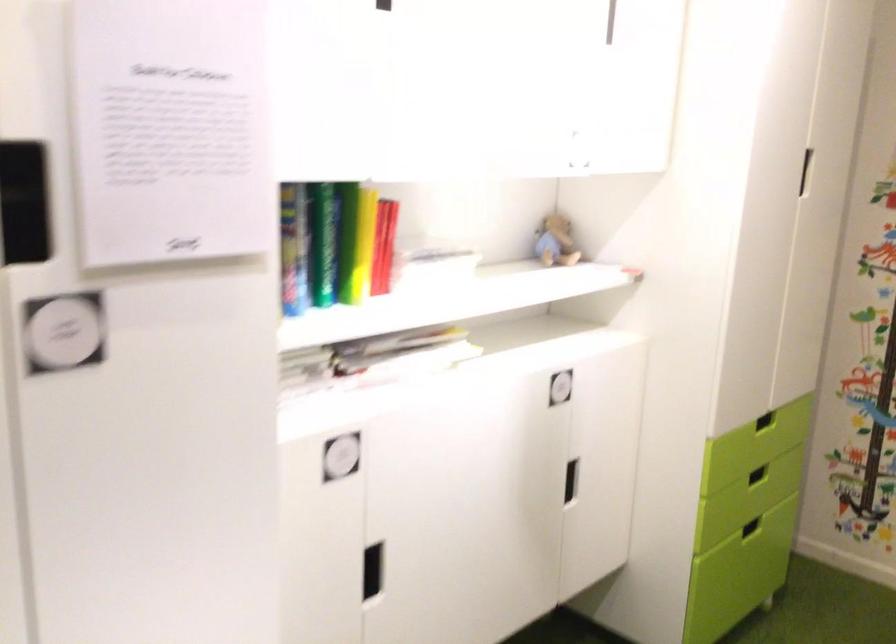
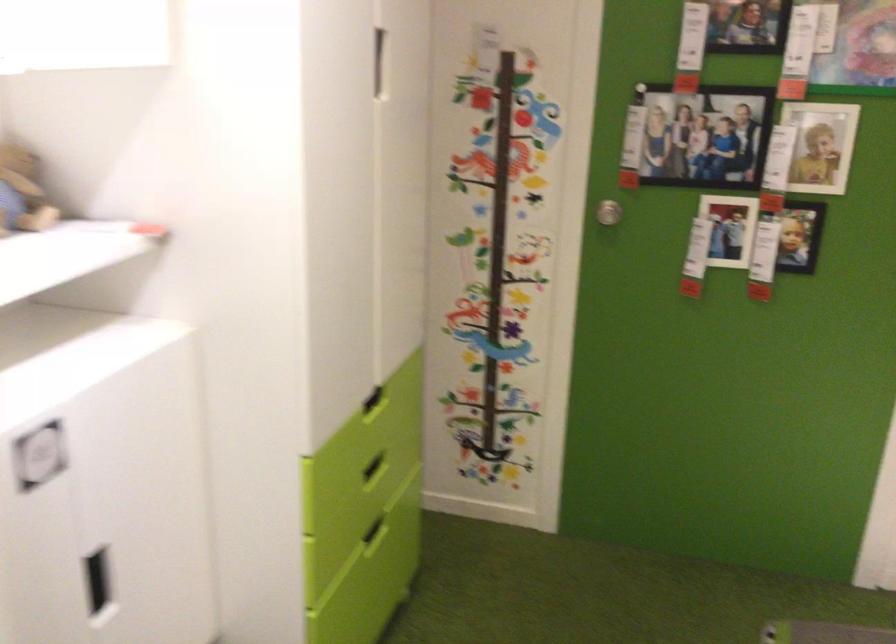
In the second image, find the point that corresponds to the point at 803,164 in the first image.

(377, 61)